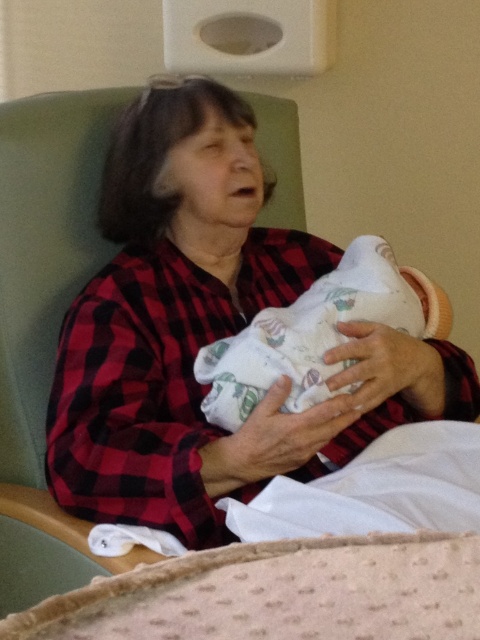
Question: Is red plaid shirt at center bigger than white soft swaddle at center?

Choices:
 (A) no
 (B) yes

Answer: (B)

Question: Is red plaid shirt at center thinner than white soft swaddle at center?

Choices:
 (A) yes
 (B) no

Answer: (B)

Question: Can you confirm if red plaid shirt at center is positioned to the left of white soft swaddle at center?

Choices:
 (A) no
 (B) yes

Answer: (B)

Question: Which of the following is the closest to the observer?

Choices:
 (A) (216, 412)
 (B) (216, 435)

Answer: (A)